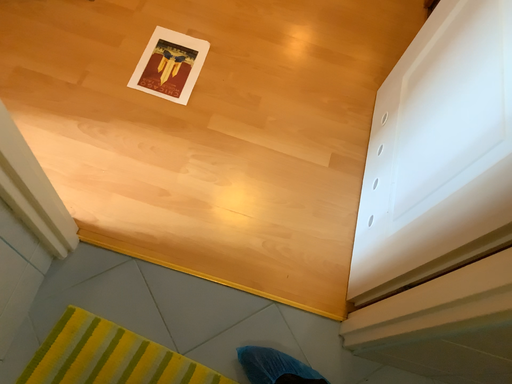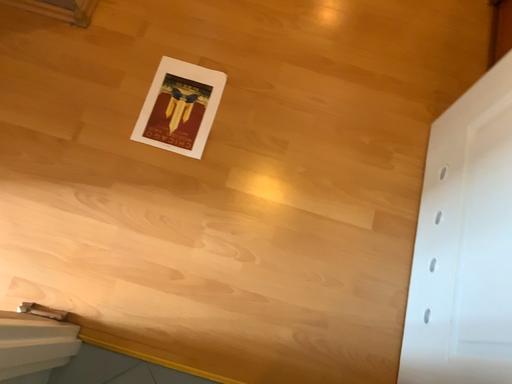
Question: Which way did the camera rotate in the video?

Choices:
 (A) rotated upward
 (B) rotated downward

Answer: (B)